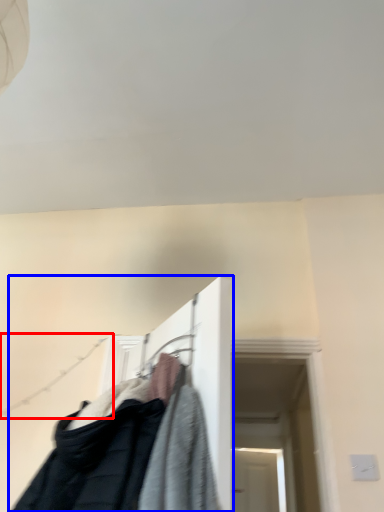
Question: Which object appears farthest to the camera in this image, clothesline (highlighted by a red box) or closet (highlighted by a blue box)?

Choices:
 (A) clothesline
 (B) closet

Answer: (A)